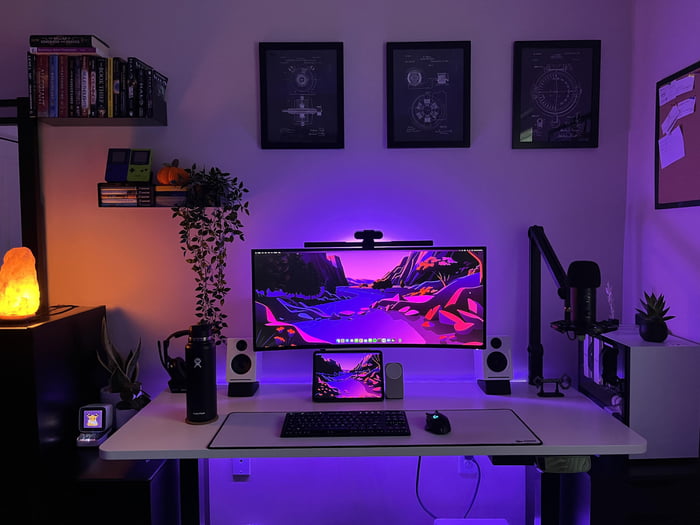
Find the location of a particular element. The width and height of the screenshot is (700, 525). dangling house plant is located at coordinates (220, 234), (200, 288).